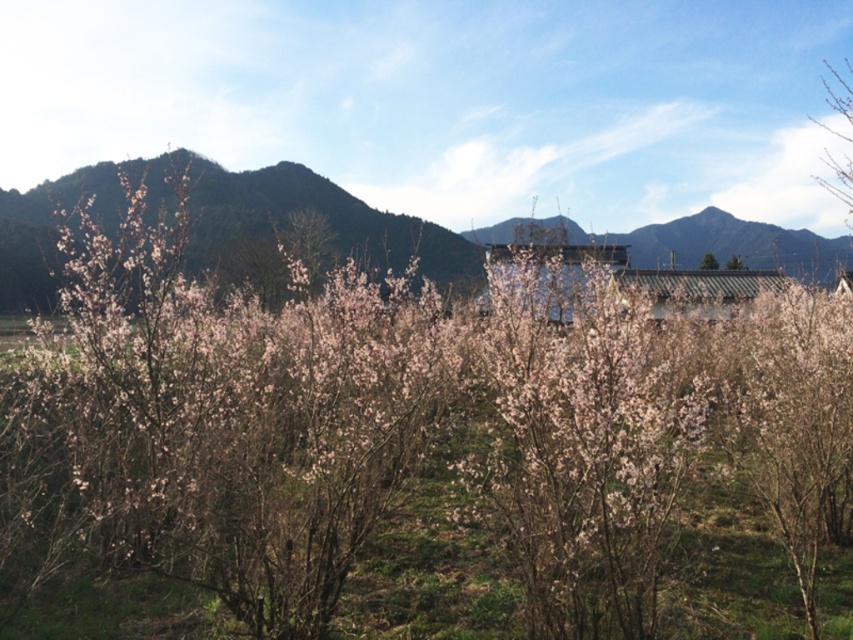
Question: Which object is farther from the camera taking this photo?

Choices:
 (A) green matte mountain at upper left
 (B) pink matte tree at center

Answer: (B)

Question: Does green matte mountain at upper left have a smaller size compared to pink blossoms at center?

Choices:
 (A) no
 (B) yes

Answer: (A)

Question: Which object is the farthest from the pink matte tree at center?

Choices:
 (A) green matte mountain at upper left
 (B) pink blossoms at center

Answer: (B)

Question: Is pink blossoms at center above pink matte tree at center?

Choices:
 (A) no
 (B) yes

Answer: (A)

Question: Is pink blossoms at center in front of pink matte tree at center?

Choices:
 (A) yes
 (B) no

Answer: (A)

Question: Which object is positioned closest to the green matte mountain at upper left?

Choices:
 (A) pink blossoms at center
 (B) pink matte tree at center

Answer: (A)